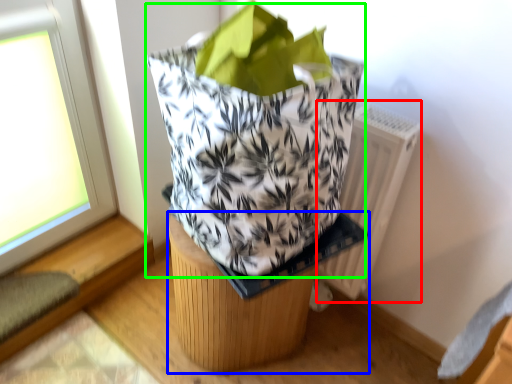
Question: Which is farther away from radiator (highlighted by a red box)? furniture (highlighted by a blue box) or grocery bag (highlighted by a green box)?

Choices:
 (A) furniture
 (B) grocery bag

Answer: (B)